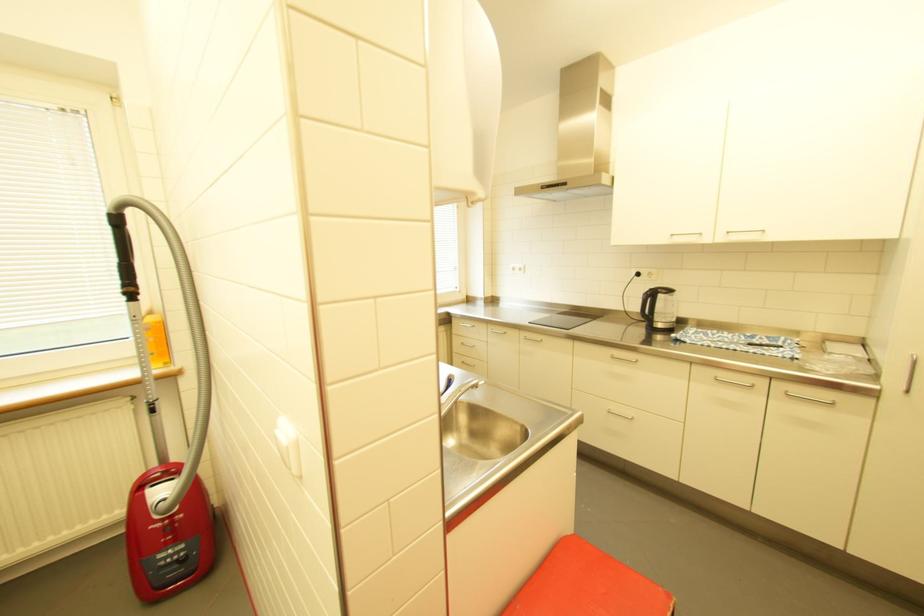
The height and width of the screenshot is (616, 924). Describe the element at coordinates (446, 384) in the screenshot. I see `a sink faucet handle` at that location.